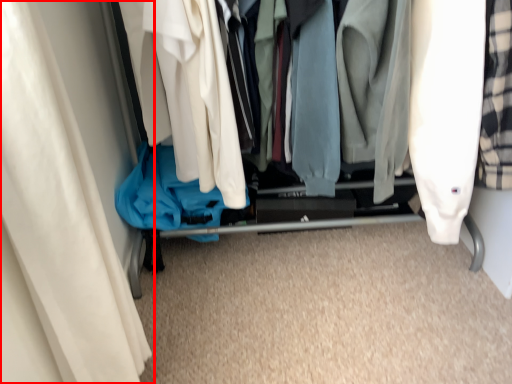
Question: From the image's perspective, where is curtain (annotated by the red box) located in relation to closet in the image?

Choices:
 (A) below
 (B) above

Answer: (A)